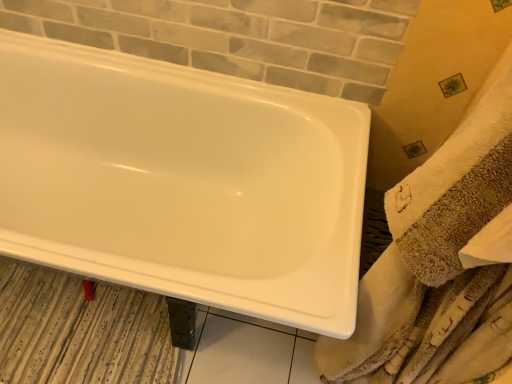
Question: Considering the relative sizes of white glossy bathtub at upper left and beige textured towel at right in the image provided, is white glossy bathtub at upper left wider than beige textured towel at right?

Choices:
 (A) no
 (B) yes

Answer: (B)

Question: From the image's perspective, does white glossy bathtub at upper left appear lower than beige textured towel at right?

Choices:
 (A) yes
 (B) no

Answer: (B)

Question: Is white glossy bathtub at upper left aimed at beige textured towel at right?

Choices:
 (A) yes
 (B) no

Answer: (B)

Question: Is beige textured towel at right located within white glossy bathtub at upper left?

Choices:
 (A) yes
 (B) no

Answer: (B)

Question: From a real-world perspective, is white glossy bathtub at upper left on beige textured towel at right?

Choices:
 (A) no
 (B) yes

Answer: (A)

Question: Is white glossy bathtub at upper left bigger than beige textured towel at right?

Choices:
 (A) yes
 (B) no

Answer: (A)

Question: Considering the relative sizes of striped fabric bath mat at lower left and white glossy bathtub at upper left in the image provided, is striped fabric bath mat at lower left taller than white glossy bathtub at upper left?

Choices:
 (A) no
 (B) yes

Answer: (A)

Question: Does striped fabric bath mat at lower left have a lesser width compared to white glossy bathtub at upper left?

Choices:
 (A) no
 (B) yes

Answer: (B)

Question: Is striped fabric bath mat at lower left closer to the viewer compared to white glossy bathtub at upper left?

Choices:
 (A) no
 (B) yes

Answer: (A)

Question: Is striped fabric bath mat at lower left outside of white glossy bathtub at upper left?

Choices:
 (A) yes
 (B) no

Answer: (B)

Question: Considering the relative sizes of striped fabric bath mat at lower left and white glossy bathtub at upper left in the image provided, is striped fabric bath mat at lower left bigger than white glossy bathtub at upper left?

Choices:
 (A) no
 (B) yes

Answer: (A)

Question: Is white glossy bathtub at upper left completely or partially inside striped fabric bath mat at lower left?

Choices:
 (A) yes
 (B) no

Answer: (B)

Question: Is striped fabric bath mat at lower left directly adjacent to beige textured towel at right?

Choices:
 (A) yes
 (B) no

Answer: (B)